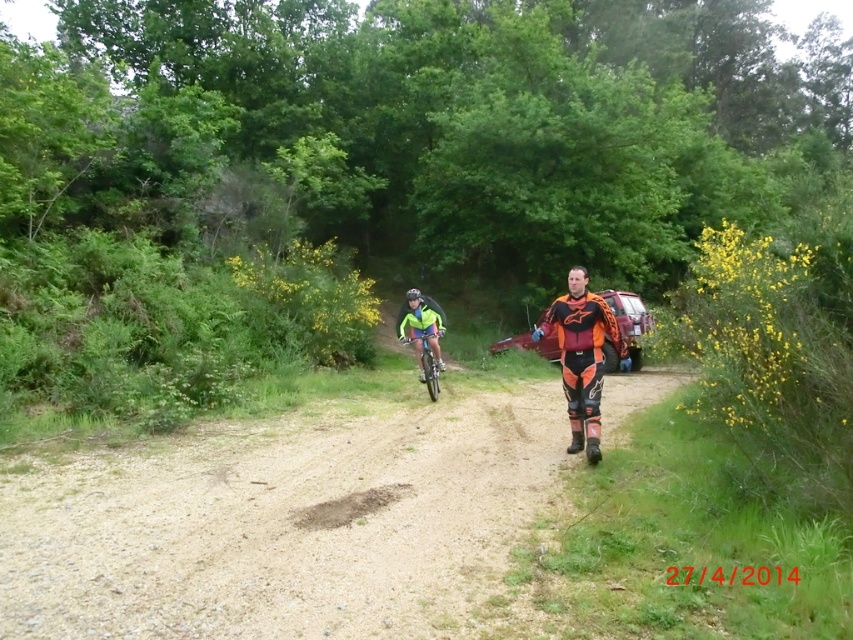
Is dirt path at center shorter than orange/black motocross suit at center?

Correct, dirt path at center is not as tall as orange/black motocross suit at center.

Describe the element at coordinates (287, 522) in the screenshot. I see `dirt path at center` at that location.

Where is `dirt path at center`? This screenshot has height=640, width=853. dirt path at center is located at coordinates (287, 522).

At what (x,y) coordinates should I click in order to perform the action: click on dirt path at center. Please return your answer as a coordinate pair (x, y). The height and width of the screenshot is (640, 853). Looking at the image, I should click on (287, 522).

Can you confirm if dirt path at center is thinner than green matte bicycle at center?

No, dirt path at center is not thinner than green matte bicycle at center.

Is dirt path at center behind green matte bicycle at center?

No.

Is point (96, 452) positioned after point (422, 349)?

No, (96, 452) is in front of (422, 349).

Where is `dirt path at center`? Image resolution: width=853 pixels, height=640 pixels. dirt path at center is located at coordinates (287, 522).

Between point (299, 509) and point (444, 364), which one is positioned behind?

The point (444, 364) is behind.

Is dirt path at center to the right of neon green fabric at center from the viewer's perspective?

In fact, dirt path at center is to the left of neon green fabric at center.

Who is more forward, (80, 624) or (412, 298)?

Point (80, 624) is in front.

Where is `dirt path at center`? The height and width of the screenshot is (640, 853). dirt path at center is located at coordinates (287, 522).